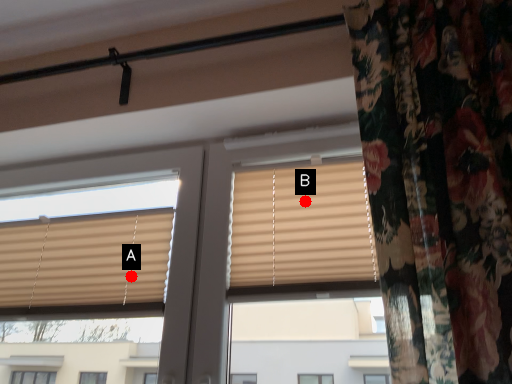
Question: Two points are circled on the image, labeled by A and B beside each circle. Among these points, which one is farthest from the camera?

Choices:
 (A) A is further
 (B) B is further

Answer: (A)